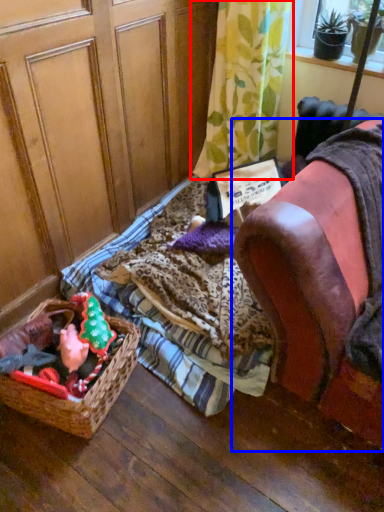
Question: Which of the following is the farthest to the observer, curtain (highlighted by a red box) or furniture (highlighted by a blue box)?

Choices:
 (A) curtain
 (B) furniture

Answer: (A)